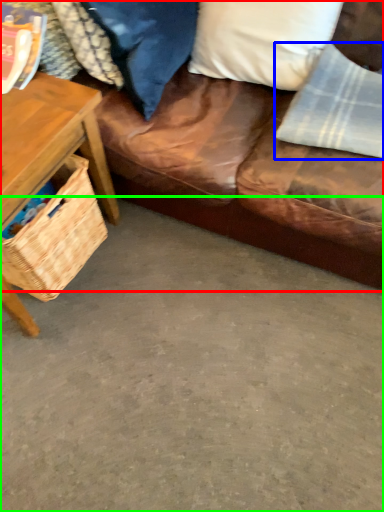
Question: Which is farther away from studio couch (highlighted by a red box)? material (highlighted by a blue box) or concrete (highlighted by a green box)?

Choices:
 (A) material
 (B) concrete

Answer: (B)